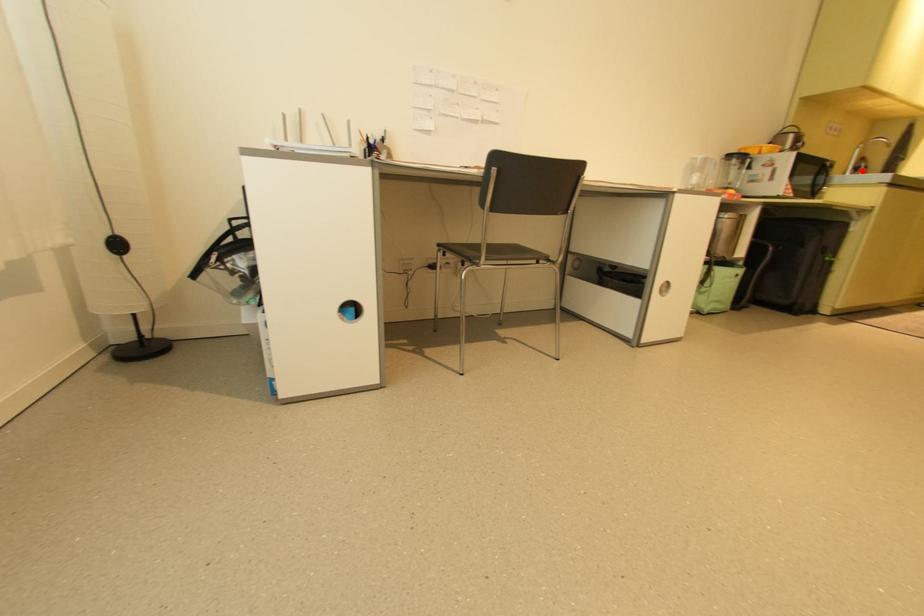
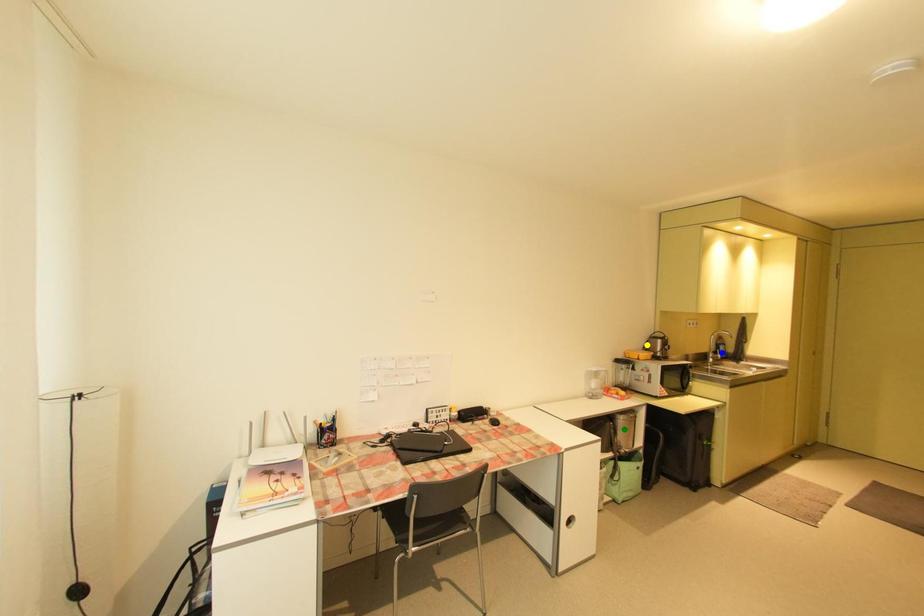
Question: I am providing you with two images of the same scene from different viewpoints. A red point is marked on the first image. You are given multiple points on the second image. Can you choose the point in image 2 that corresponds to the point in image 1?

Choices:
 (A) blue point
 (B) green point
 (C) yellow point

Answer: (A)